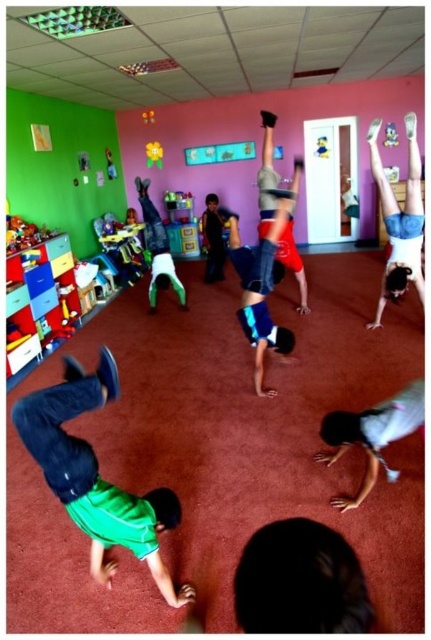
Looking at this image, who is taller, denim shorts at upper right or rubberized yellow ball at center?

Standing taller between the two is denim shorts at upper right.

Is point (400, 225) positioned in front of point (143, 116)?

Yes, point (400, 225) is in front of point (143, 116).

Find the location of a particular element. The width and height of the screenshot is (431, 640). denim shorts at upper right is located at coordinates (399, 220).

In the scene shown: Between plush pink hedgehog at upper center and yellow plush duck at upper center, which one appears on the left side from the viewer's perspective?

From the viewer's perspective, yellow plush duck at upper center appears more on the left side.

Does point (387, 132) lie behind point (316, 147)?

No, (387, 132) is closer to viewer.

Between point (390, 124) and point (318, 150), which one is positioned behind?

The point (318, 150) is more distant.

Where is `plush pink hedgehog at upper center`? The image size is (431, 640). plush pink hedgehog at upper center is located at coordinates (390, 134).

Describe the element at coordinates (96, 476) in the screenshot. The image size is (431, 640). I see `green matte shirt at lower left` at that location.

Does green matte shirt at lower left appear on the right side of rubberized yellow ball at center?

Indeed, green matte shirt at lower left is positioned on the right side of rubberized yellow ball at center.

Where is `green matte shirt at lower left`? Image resolution: width=431 pixels, height=640 pixels. green matte shirt at lower left is located at coordinates [96, 476].